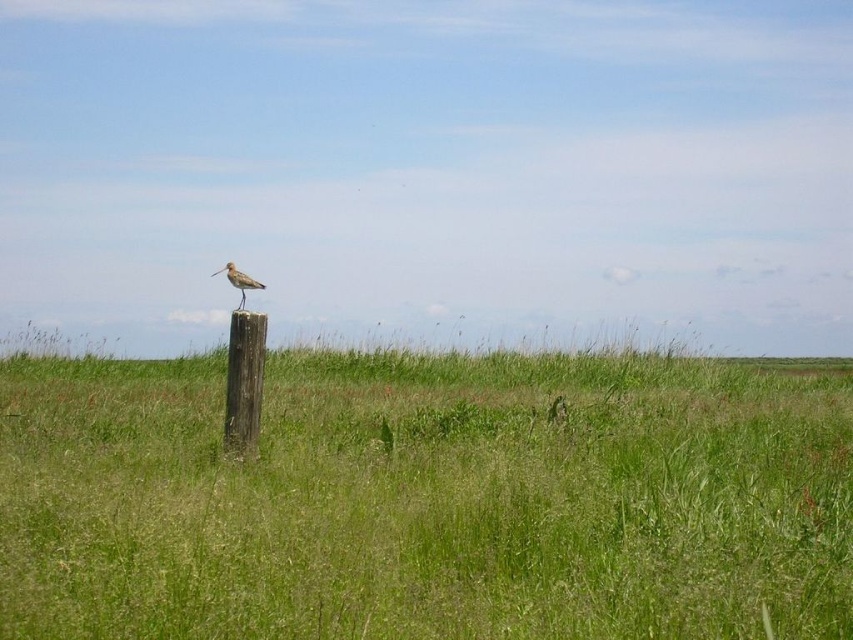
Question: Among these objects, which one is nearest to the camera?

Choices:
 (A) green grassy field at center
 (B) brown speckled feathered bird at center
 (C) brown wooden post at center

Answer: (A)

Question: Which object is closer to the camera taking this photo?

Choices:
 (A) brown speckled feathered bird at center
 (B) green grassy field at center

Answer: (B)

Question: Which object is the closest to the green grassy field at center?

Choices:
 (A) brown wooden post at center
 (B) brown speckled feathered bird at center

Answer: (A)

Question: Does green grassy field at center appear over brown wooden post at center?

Choices:
 (A) no
 (B) yes

Answer: (A)

Question: Does green grassy field at center appear on the right side of brown speckled feathered bird at center?

Choices:
 (A) no
 (B) yes

Answer: (B)

Question: In this image, where is green grassy field at center located relative to brown speckled feathered bird at center?

Choices:
 (A) right
 (B) left

Answer: (A)